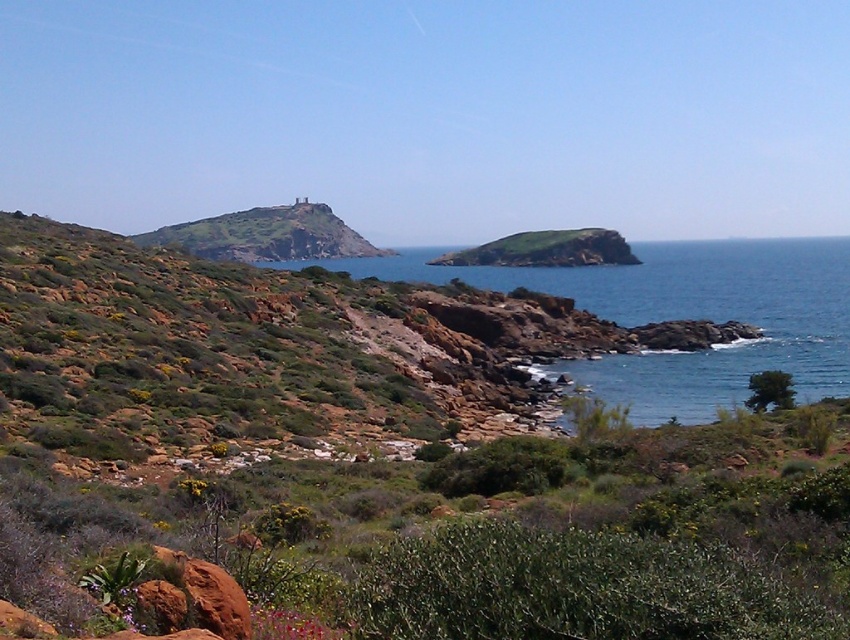
You are a hiker planning to take a photo of the green grassy hillside at center and the green leafy bush at lower right. Which object should you focus on first if you want to capture both in one frame without moving the camera?

The green grassy hillside at center is larger in size than the green leafy bush at lower right, so you should focus on the green grassy hillside at center first to ensure it fills the frame appropriately before adjusting for the smaller bush.

You are standing on the rugged terrain in the foreground and want to take a photo of the blue water at center and the green grassy hillside at left. Which object will appear closer to the camera in the photo?

The blue water at center will appear closer to the camera in the photo because it is positioned in front of the green grassy hillside at left.